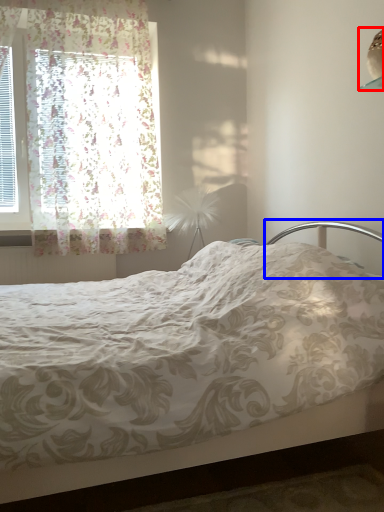
Question: Which object is further to the camera taking this photo, lamp (highlighted by a red box) or headboard (highlighted by a blue box)?

Choices:
 (A) lamp
 (B) headboard

Answer: (A)